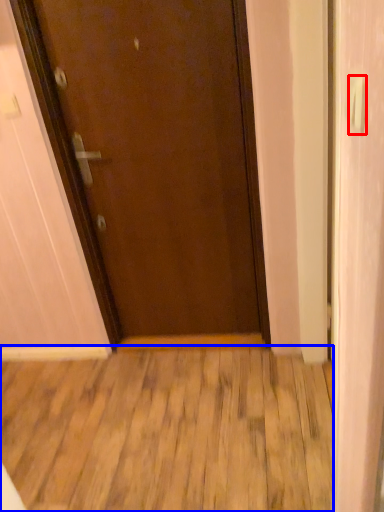
Question: Which of the following is the farthest to the observer, door handle (highlighted by a red box) or wood (highlighted by a blue box)?

Choices:
 (A) door handle
 (B) wood

Answer: (B)